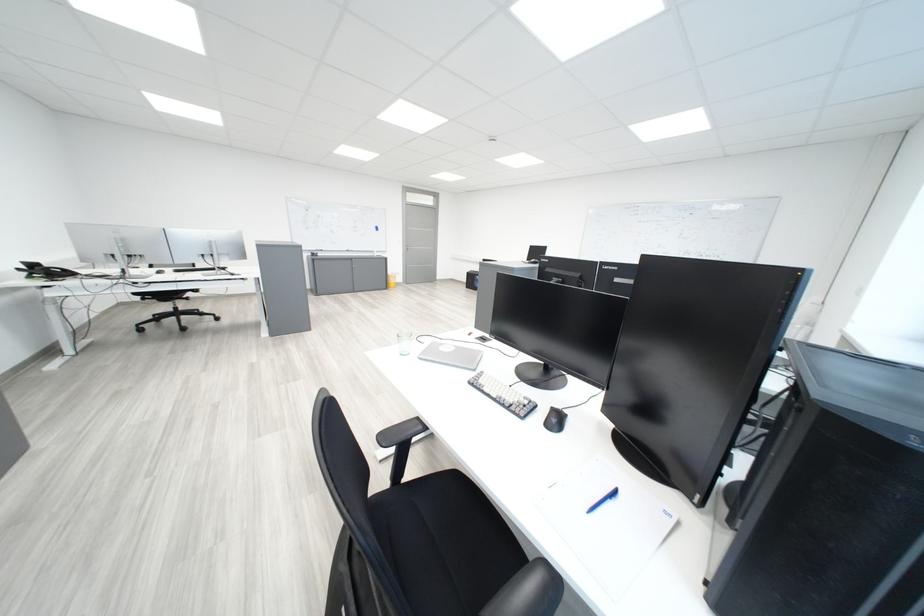
The height and width of the screenshot is (616, 924). What do you see at coordinates (400, 438) in the screenshot?
I see `the black chair armrest` at bounding box center [400, 438].